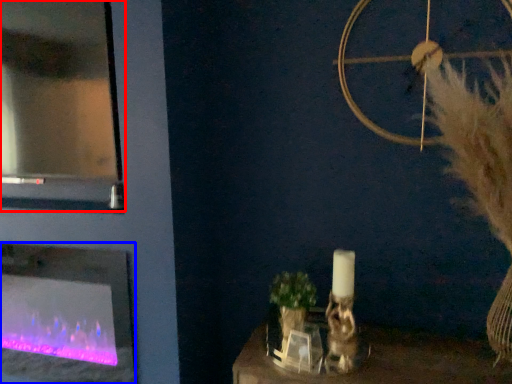
Question: Which of the following is the closest to the observer, glass door (highlighted by a red box) or fireplace (highlighted by a blue box)?

Choices:
 (A) glass door
 (B) fireplace

Answer: (A)